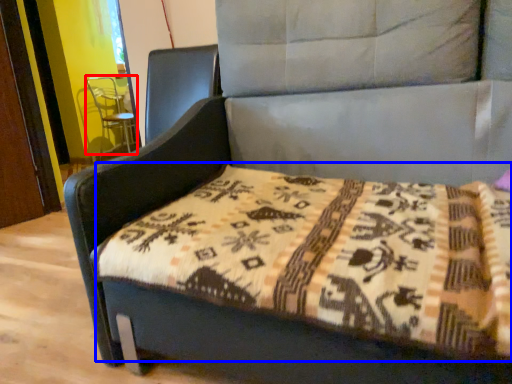
Question: Which of the following is the farthest to the observer, swivel chair (highlighted by a red box) or mattress (highlighted by a blue box)?

Choices:
 (A) swivel chair
 (B) mattress

Answer: (A)